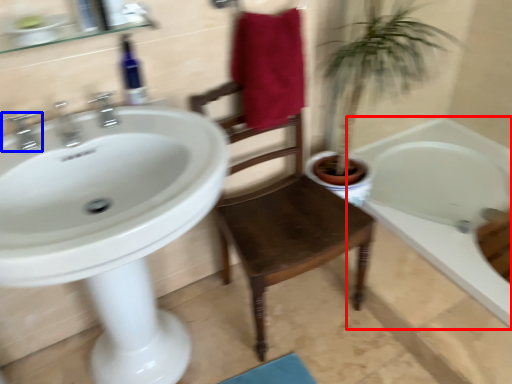
Question: Which point is closer to the camera, bathtub (highlighted by a red box) or tap (highlighted by a blue box)?

Choices:
 (A) bathtub
 (B) tap

Answer: (B)